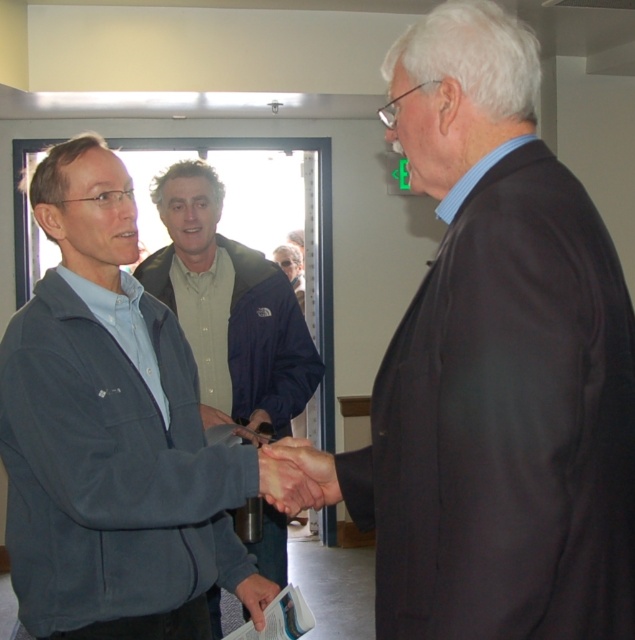
Is point (88, 372) positioned behind point (185, 204)?

No.

Does dark gray fleece jacket at left appear under matte blue jacket at center?

Yes, dark gray fleece jacket at left is below matte blue jacket at center.

Does point (13, 499) come in front of point (210, 284)?

Yes, it is in front of point (210, 284).

Locate an element on the screen. The image size is (635, 640). dark gray fleece jacket at left is located at coordinates (109, 468).

Does matte blue jacket at center appear under white paper at center?

No, matte blue jacket at center is not below white paper at center.

Which is behind, point (190, 266) or point (260, 618)?

The point (190, 266) is more distant.

Is point (210, 600) in front of point (254, 584)?

No, (210, 600) is behind (254, 584).

Identify the location of matte blue jacket at center. Image resolution: width=635 pixels, height=640 pixels. (229, 307).

Who is more distant from viewer, [462,385] or [286,376]?

The point [286,376] is more distant.

Is dark gray suit at right wider than matte blue jacket at center?

Incorrect, dark gray suit at right's width does not surpass matte blue jacket at center's.

Locate an element on the screen. dark gray suit at right is located at coordinates (497, 365).